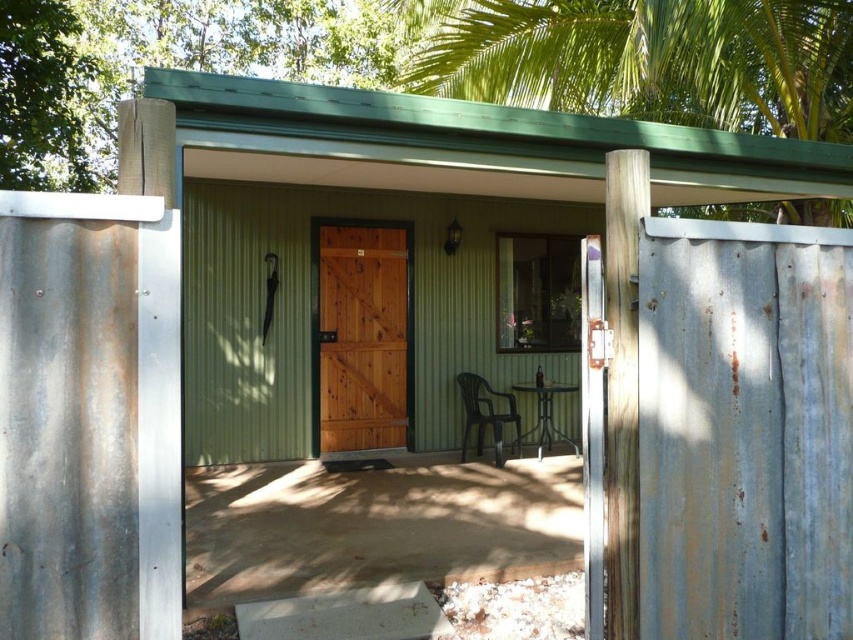
Question: Can you confirm if green leafy palm tree at upper center is positioned to the left of black plastic chair at center?

Choices:
 (A) yes
 (B) no

Answer: (B)

Question: Estimate the real-world distances between objects in this image. Which object is farther from the green leafy palm tree at upper center?

Choices:
 (A) wooden door at center
 (B) black plastic chair at center

Answer: (A)

Question: Where is wooden door at center located in relation to black plastic chair at center in the image?

Choices:
 (A) left
 (B) right

Answer: (A)

Question: Which point is farther from the camera taking this photo?

Choices:
 (A) (398, 246)
 (B) (469, 426)
 (C) (573, 74)

Answer: (C)

Question: Can you confirm if green leafy palm tree at upper center is thinner than black plastic chair at center?

Choices:
 (A) yes
 (B) no

Answer: (B)

Question: Considering the real-world distances, which object is farthest from the black plastic chair at center?

Choices:
 (A) green leafy palm tree at upper center
 (B) wooden door at center

Answer: (A)